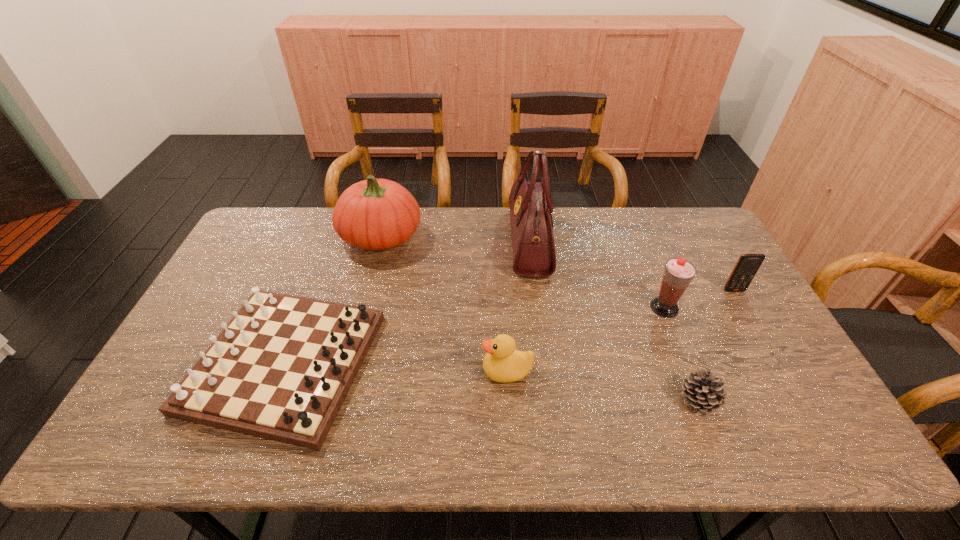
Locate an element on the screen. vacant space that satisfies the following two spatial constraints: 1. at the beak of the pinecone; 2. on the left side of the duck is located at coordinates (509, 400).

Where is `vacant space that satisfies the following two spatial constraints: 1. on the front-facing side of the tallest object; 2. on the back side of the smoothie`? This screenshot has height=540, width=960. vacant space that satisfies the following two spatial constraints: 1. on the front-facing side of the tallest object; 2. on the back side of the smoothie is located at coordinates (538, 308).

At what (x,y) coordinates should I click in order to perform the action: click on free space that satisfies the following two spatial constraints: 1. on the front side of the pinecone; 2. on the right side of the sixth shortest object. Please return your answer as a coordinate pair (x, y). Looking at the image, I should click on (339, 400).

You are a GUI agent. You are given a task and a screenshot of the screen. Output one action in this format:
    pyautogui.click(x=<x>, y=<y>)
    Task: Click on the free location that satisfies the following two spatial constraints: 1. on the front-facing side of the tallest object; 2. on the right side of the pinecone
    This screenshot has height=540, width=960.
    Given the screenshot: What is the action you would take?
    pyautogui.click(x=549, y=400)

I want to click on free point that satisfies the following two spatial constraints: 1. on the front-facing side of the fifth shortest object; 2. on the left side of the tallest object, so click(538, 308).

This screenshot has height=540, width=960. I want to click on free location that satisfies the following two spatial constraints: 1. at the beak of the pinecone; 2. on the left side of the duck, so click(x=509, y=400).